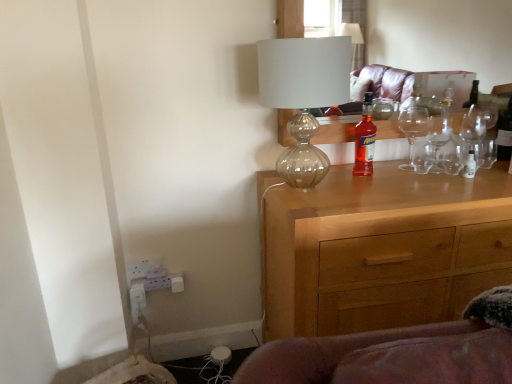
Where is `vacant area that lies to the right of transparent glass lampshade at upper center`? The height and width of the screenshot is (384, 512). vacant area that lies to the right of transparent glass lampshade at upper center is located at coordinates (384, 190).